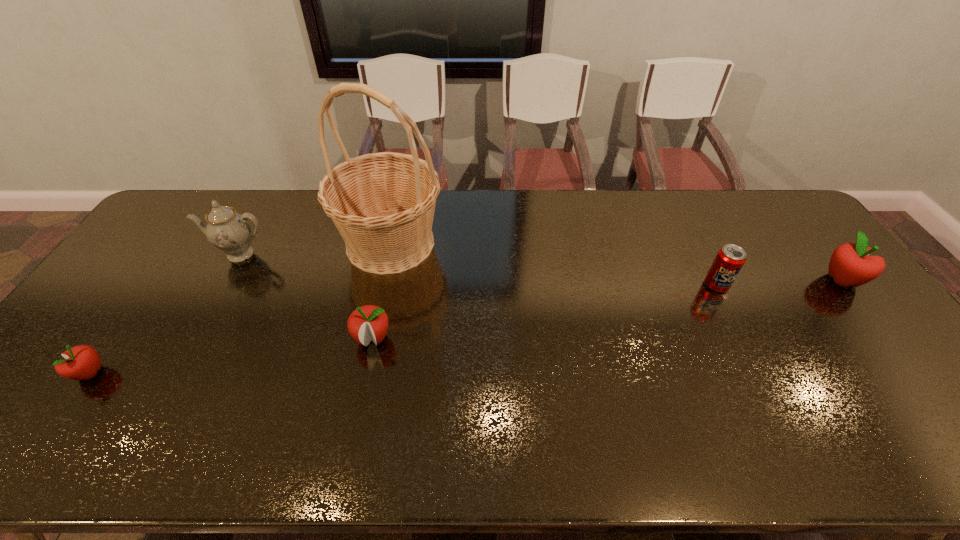
Where is `object that is at the near left corner`? This screenshot has height=540, width=960. object that is at the near left corner is located at coordinates (82, 362).

You are a GUI agent. You are given a task and a screenshot of the screen. Output one action in this format:
    pyautogui.click(x=<x>, y=<y>)
    Task: Click on the vacant space at the far edge of the desktop
    Image resolution: width=960 pixels, height=540 pixels.
    Given the screenshot: What is the action you would take?
    pyautogui.click(x=589, y=204)

Image resolution: width=960 pixels, height=540 pixels. What are the coordinates of `vacant space at the near edge of the desktop` in the screenshot? It's located at coord(237,396).

Identify the location of free spot at the left edge of the desktop. (148, 269).

In order to click on blank space at the right edge of the desktop in this screenshot , I will do `click(876, 319)`.

Identify the location of vacant region at the near left corner of the desktop. This screenshot has width=960, height=540. (62, 412).

Locate an element on the screen. vacant space in between the fifth object from left to right and the second tallest object is located at coordinates (478, 269).

Identify the location of empty space that is in between the basket and the second tallest object. The height and width of the screenshot is (540, 960). (315, 248).

This screenshot has width=960, height=540. I want to click on free space between the second farthest apple and the tallest object, so click(x=381, y=291).

Where is `vacant space that's between the second nearest apple and the tallest object`? The width and height of the screenshot is (960, 540). vacant space that's between the second nearest apple and the tallest object is located at coordinates (381, 291).